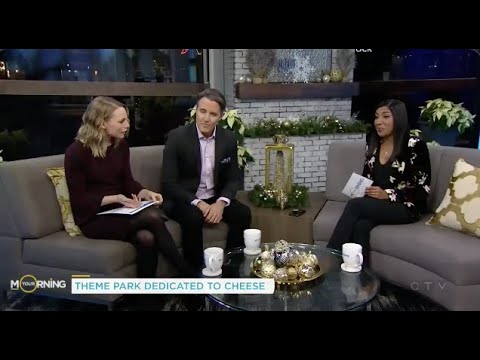
Find the location of a particular element. garland is located at coordinates (310, 126).